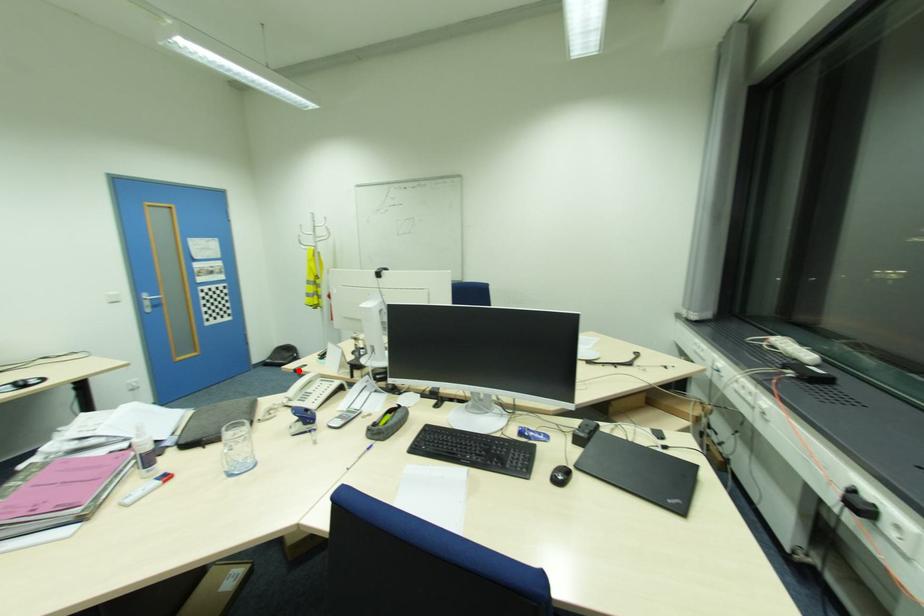
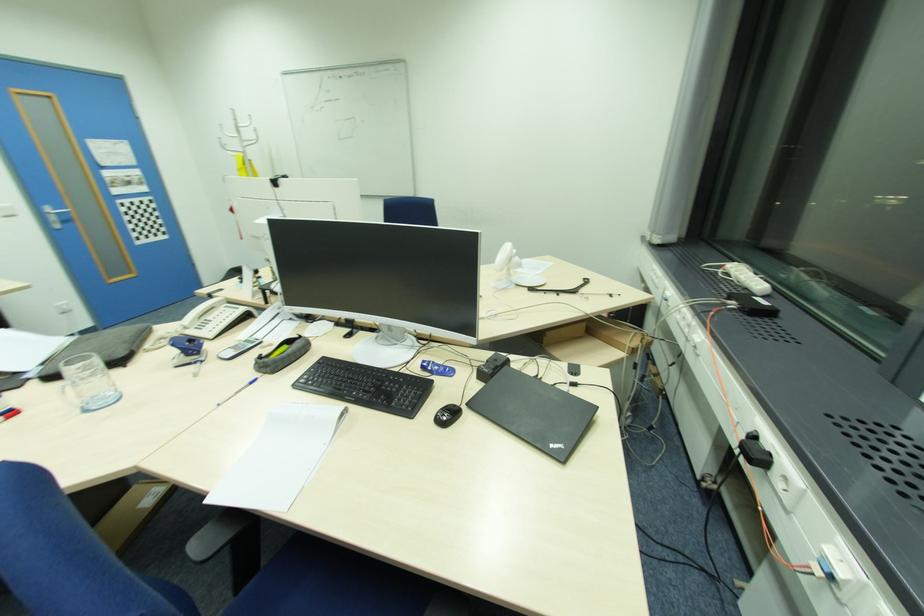
Where in the second image is the point corresponding to the highlighted location from the first image?

(213, 294)